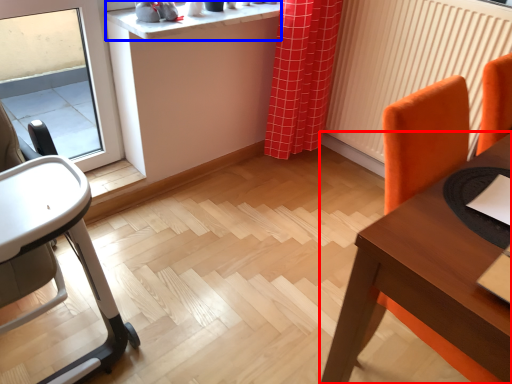
Question: Which point is further to the camera, table (highlighted by a red box) or counter top (highlighted by a blue box)?

Choices:
 (A) table
 (B) counter top

Answer: (B)